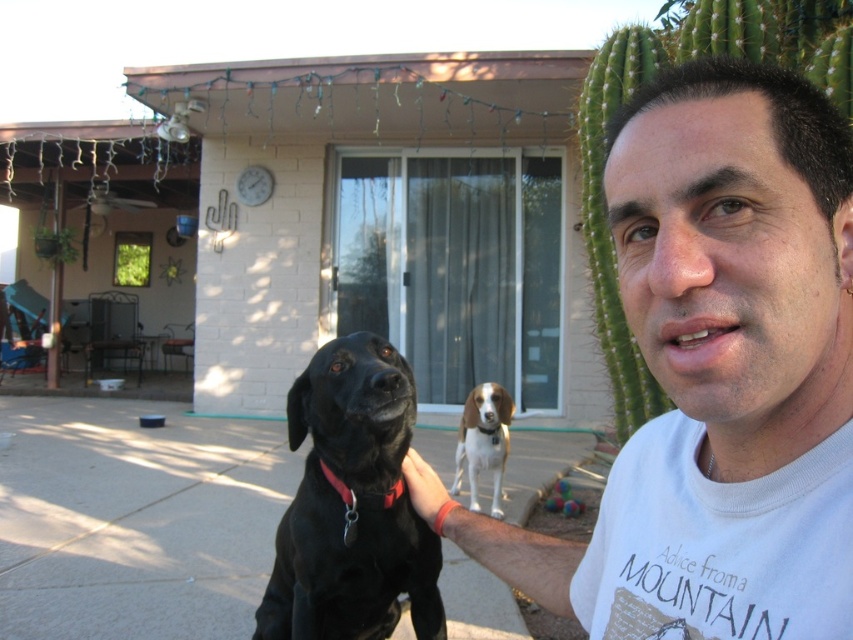
Based on the scene description, can you determine which object is closer to the observer, the shiny black dog at center or the green spiny cactus at right?

The shiny black dog at center is closer to the observer because it is positioned in front of the green spiny cactus at right.

You are a photographer trying to capture a photo of the shiny black dog at center and the green spiny cactus at right. Based on their positions, which object is closer to the camera?

The shiny black dog at center is closer to the camera than the green spiny cactus at right because it is positioned below it.